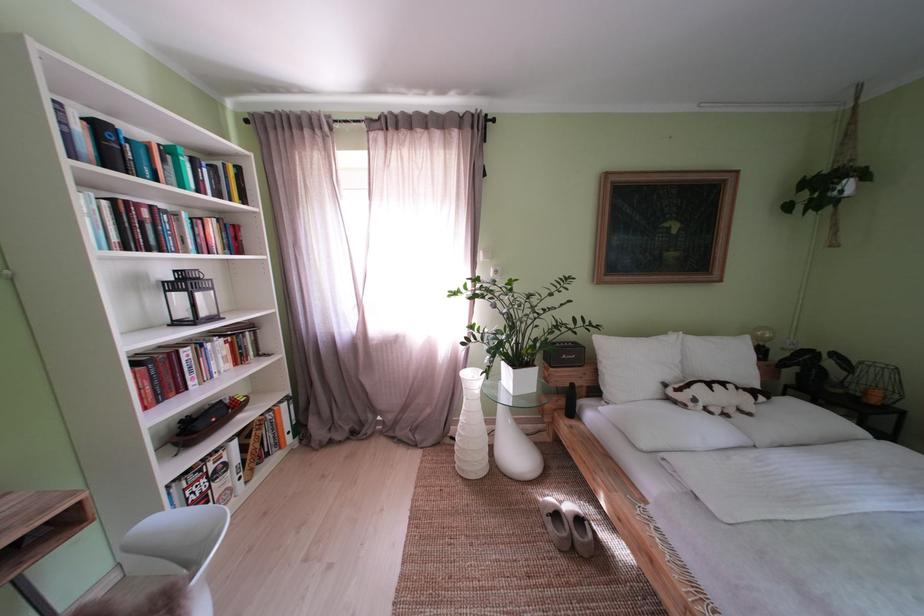
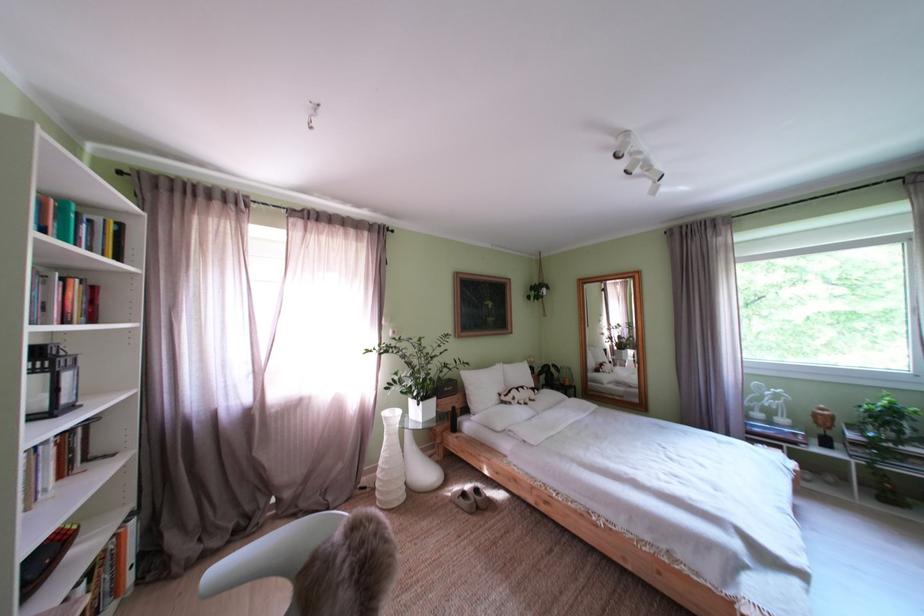
Find the pixel in the second image that matches (x=472, y=424) in the first image.

(395, 460)